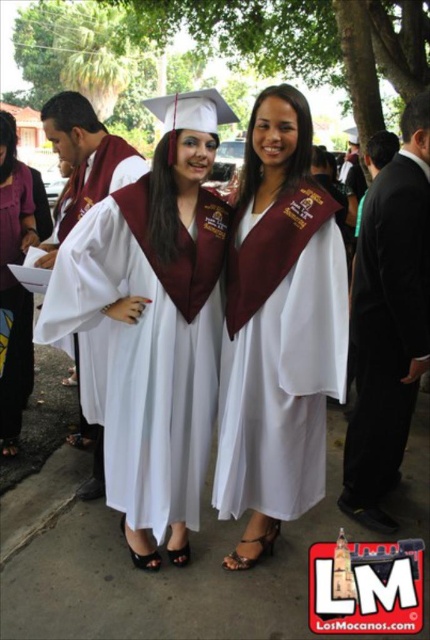
Between white satin gown at center and black suit at right, which one has more height?

black suit at right

Does white satin gown at center have a lesser width compared to black suit at right?

No.

Is point (257, 496) positioned before point (384, 237)?

Yes, it is in front of point (384, 237).

Where is `white satin gown at center`? Image resolution: width=430 pixels, height=640 pixels. white satin gown at center is located at coordinates (279, 330).

Is point (209, 100) less distant than point (417, 362)?

Yes, it is in front of point (417, 362).

Can you confirm if white matte graduation gown at center is wider than black suit at right?

Correct, the width of white matte graduation gown at center exceeds that of black suit at right.

Does point (156, 532) come behind point (356, 362)?

No.

The height and width of the screenshot is (640, 430). Find the location of `white matte graduation gown at center`. white matte graduation gown at center is located at coordinates (153, 323).

Which is above, maroon satin graduation gown at left or matte white gown at center?

maroon satin graduation gown at left is higher up.

Which of these two, maroon satin graduation gown at left or matte white gown at center, stands taller?

matte white gown at center

This screenshot has height=640, width=430. What do you see at coordinates (85, 160) in the screenshot? I see `maroon satin graduation gown at left` at bounding box center [85, 160].

This screenshot has width=430, height=640. Identify the location of maroon satin graduation gown at left. (85, 160).